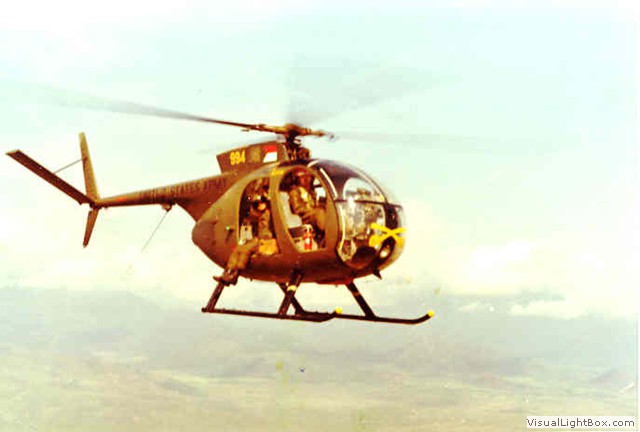
Identify the location of light source. (505, 267).